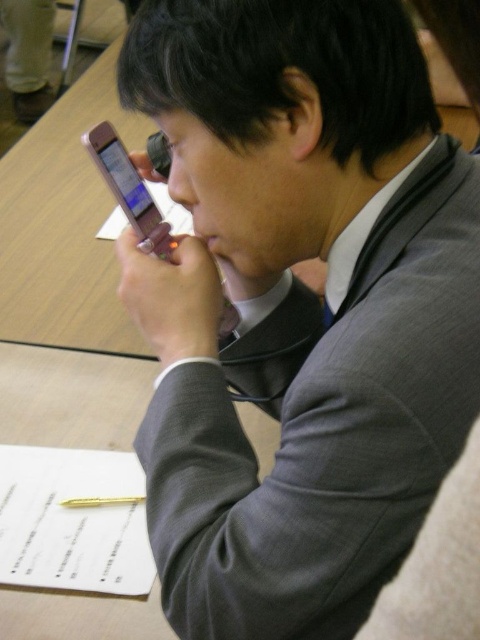
You are organizing a meeting and need to place both the pink glossy smartphone at center and the gold metallic pen at lower center on a small desk. Considering their sizes, which object should you place closer to the edge of the desk to prevent them from falling off?

The gold metallic pen at lower center should be placed closer to the edge of the desk because it is smaller in size than the pink glossy smartphone at center, making it less stable and more prone to accidental knocks.

You are an assistant who needs to locate the pink glossy smartphone at center in the image. What are the coordinates where you can find it?

The pink glossy smartphone at center can be found at coordinates point (129, 189).

You are a photographer trying to capture a closeup of the gold metallic pen at lower center without including the pink glossy smartphone at center in the frame. Based on their positions, is this possible?

The pink glossy smartphone at center is to the right of the gold metallic pen at lower center, so by positioning the camera to the left side of the pen, you can capture the gold metallic pen at lower center without including the smartphone in the frame.